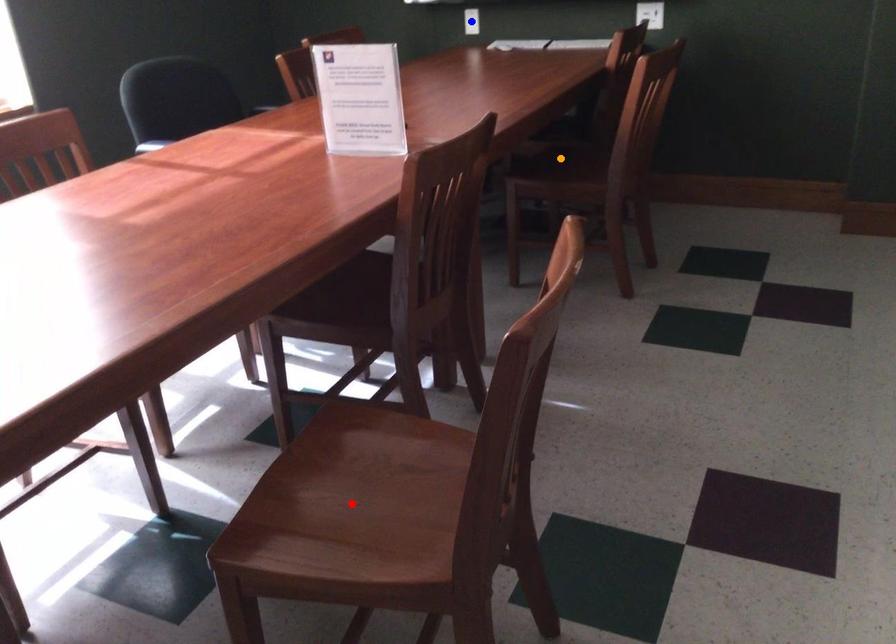
Order these from farthest to nearest:
blue point
orange point
red point

blue point
orange point
red point